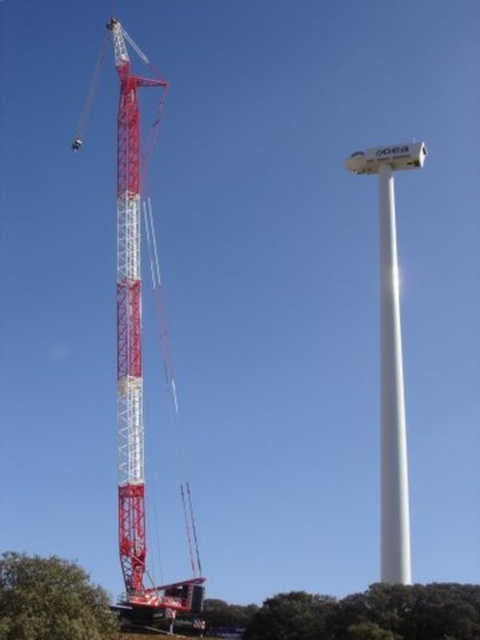
Which is in front, point (462, 620) or point (100, 627)?

Point (100, 627) is in front.

Does green leafy tree at lower center have a greater width compared to green leafy tree at lower left?

Correct, the width of green leafy tree at lower center exceeds that of green leafy tree at lower left.

Is point (290, 632) closer to viewer compared to point (84, 611)?

That is False.

Identify the location of green leafy tree at lower center. (372, 612).

Who is taller, red painted metal tower crane at left or green leafy tree at lower left?

red painted metal tower crane at left

Who is higher up, red painted metal tower crane at left or green leafy tree at lower left?

red painted metal tower crane at left is higher up.

Where is `red painted metal tower crane at left`? This screenshot has height=640, width=480. red painted metal tower crane at left is located at coordinates (140, 372).

Is red painted metal tower crane at left smaller than green leafy tree at lower center?

No, red painted metal tower crane at left is not smaller than green leafy tree at lower center.

Does red painted metal tower crane at left come in front of green leafy tree at lower center?

No, red painted metal tower crane at left is further to the viewer.

Identify the location of red painted metal tower crane at left. The height and width of the screenshot is (640, 480). coord(140,372).

The image size is (480, 640). I want to click on red painted metal tower crane at left, so click(140, 372).